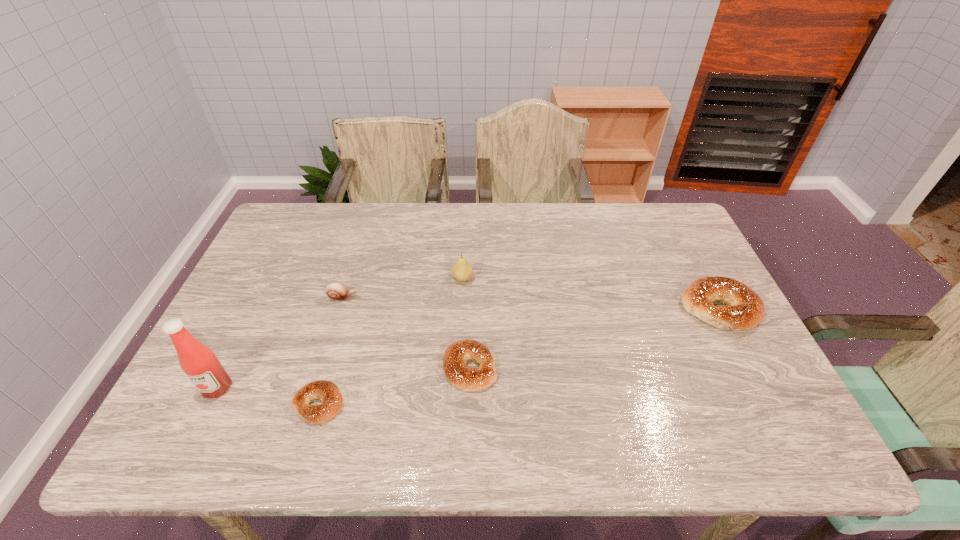
Identify the location of blank space at the near edge. The image size is (960, 540). [696, 393].

In the image, there is a desktop. Where is `free space at the right edge`? free space at the right edge is located at coordinates (706, 326).

Identify the location of vacant point located between the escargot and the pear. This screenshot has width=960, height=540. pos(402,288).

The width and height of the screenshot is (960, 540). Identify the location of vacant region between the escargot and the rightmost bagel. (531, 303).

Locate an element on the screen. empty space that is in between the leftmost bagel and the pear is located at coordinates (391, 341).

The width and height of the screenshot is (960, 540). Identify the location of free space that is in between the fifth tallest object and the escargot. (406, 333).

In order to click on vacant region between the fifth shortest object and the tallest bagel in this screenshot , I will do `click(590, 293)`.

At what (x,y) coordinates should I click in order to perform the action: click on empty location between the escargot and the rightmost object. Please return your answer as a coordinate pair (x, y). This screenshot has height=540, width=960. Looking at the image, I should click on (531, 303).

The image size is (960, 540). What are the coordinates of `empty space that is in between the second shortest bagel and the pear` in the screenshot? It's located at (466, 323).

Locate an element on the screen. The image size is (960, 540). free space that is in between the shortest bagel and the pear is located at coordinates (391, 341).